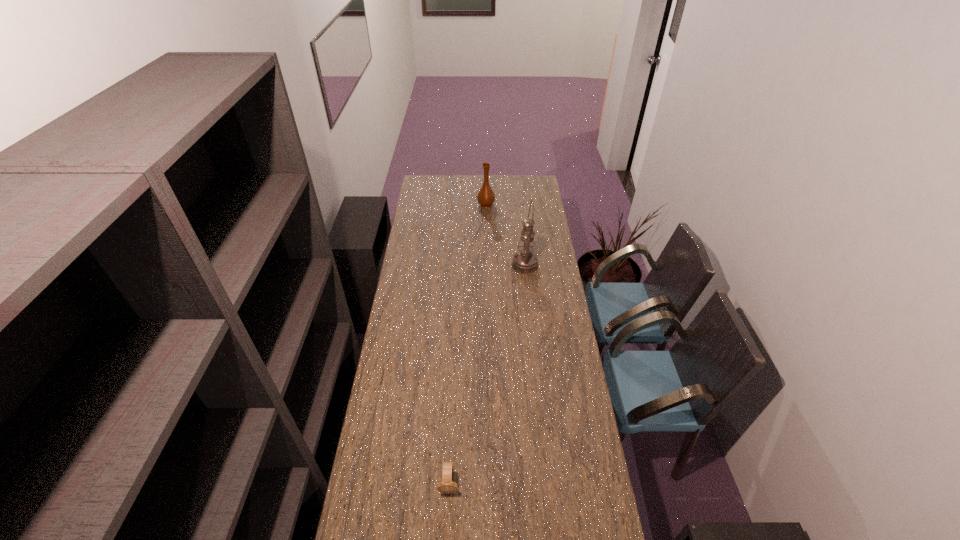
I want to click on vacant space at the far edge of the desktop, so click(x=516, y=183).

This screenshot has width=960, height=540. What are the coordinates of `vacant space at the left edge of the desktop` in the screenshot? It's located at (396, 460).

Locate an element on the screen. This screenshot has width=960, height=540. free space at the right edge is located at coordinates (533, 308).

Locate an element on the screen. vacant region at the far left corner of the desktop is located at coordinates (429, 179).

This screenshot has width=960, height=540. I want to click on blank space at the far right corner, so click(x=518, y=184).

In order to click on vacant area that lies between the second tallest object and the second nearest object in this screenshot , I will do `click(505, 235)`.

The width and height of the screenshot is (960, 540). In order to click on blank region between the vase and the oil lamp in this screenshot , I will do `click(505, 235)`.

Locate an element on the screen. The width and height of the screenshot is (960, 540). free spot between the leftmost object and the farthest object is located at coordinates (468, 345).

Locate an element on the screen. This screenshot has width=960, height=540. empty space between the second object from right to left and the rightmost object is located at coordinates (505, 235).

Identify which object is the second closest to the tallest object. Please provide its 2D coordinates. Your answer should be formatted as a tuple, i.e. [(x, y)], where the tuple contains the x and y coordinates of a point satisfying the conditions above.

[(447, 485)]